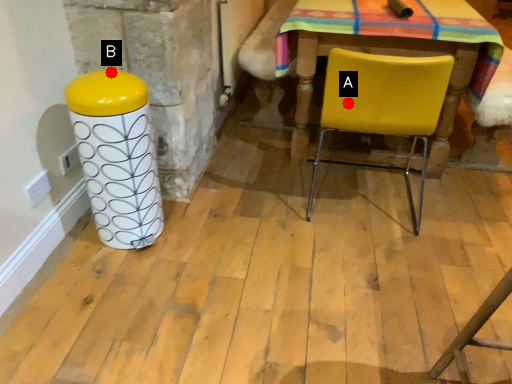
Question: Two points are circled on the image, labeled by A and B beside each circle. Which point is farther from the camera taking this photo?

Choices:
 (A) A is further
 (B) B is further

Answer: (A)